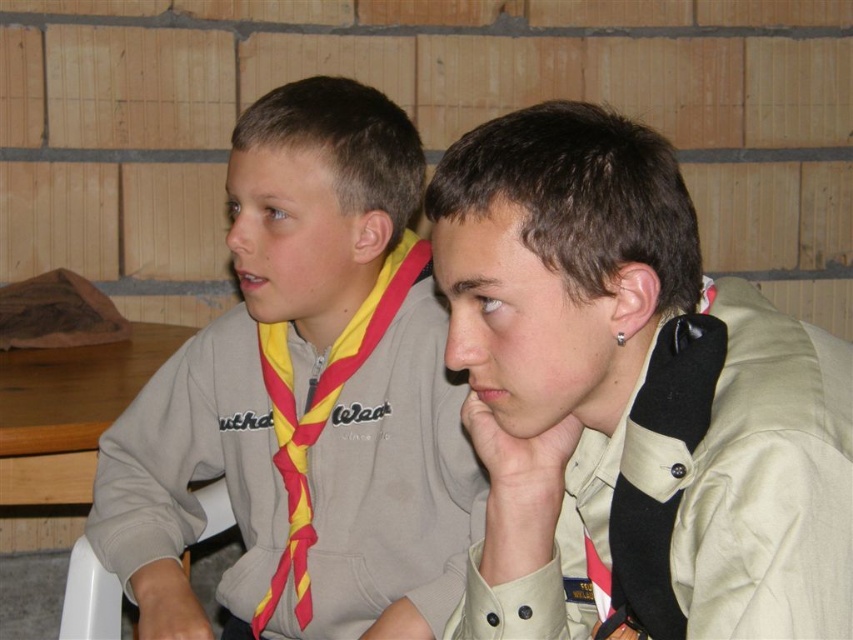
How distant is gray fleece sweatshirt at left from yellow/red striped neckerchief at center?

A distance of 6.18 inches exists between gray fleece sweatshirt at left and yellow/red striped neckerchief at center.

Is gray fleece sweatshirt at left to the left of yellow/red striped neckerchief at center from the viewer's perspective?

Yes, gray fleece sweatshirt at left is to the left of yellow/red striped neckerchief at center.

I want to click on gray fleece sweatshirt at left, so click(302, 403).

Can you confirm if tan uniform shirt at center is positioned above yellow/red striped neckerchief at center?

No, tan uniform shirt at center is not above yellow/red striped neckerchief at center.

Between point (685, 608) and point (334, 260), which one is positioned in front?

Point (685, 608) is more forward.

The height and width of the screenshot is (640, 853). I want to click on tan uniform shirt at center, so click(631, 401).

Measure the distance between tan uniform shirt at center and gray fleece sweatshirt at left.

tan uniform shirt at center and gray fleece sweatshirt at left are 16.34 inches apart.

Image resolution: width=853 pixels, height=640 pixels. What do you see at coordinates (631, 401) in the screenshot?
I see `tan uniform shirt at center` at bounding box center [631, 401].

The image size is (853, 640). What do you see at coordinates (631, 401) in the screenshot? I see `tan uniform shirt at center` at bounding box center [631, 401].

At what (x,y) coordinates should I click in order to perform the action: click on tan uniform shirt at center. Please return your answer as a coordinate pair (x, y). The image size is (853, 640). Looking at the image, I should click on (631, 401).